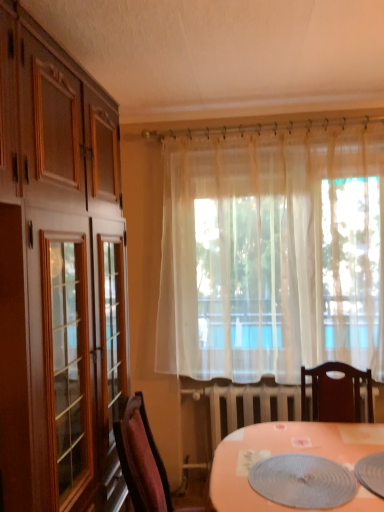
Question: Is sheer white curtain at center at the back of textured gray placemat at lower center?

Choices:
 (A) no
 (B) yes

Answer: (A)

Question: Is textured gray placemat at lower center not near sheer white curtain at center?

Choices:
 (A) no
 (B) yes

Answer: (B)

Question: Does textured gray placemat at lower center appear on the left side of sheer white curtain at center?

Choices:
 (A) no
 (B) yes

Answer: (B)

Question: Considering the relative sizes of textured gray placemat at lower center and sheer white curtain at center in the image provided, is textured gray placemat at lower center shorter than sheer white curtain at center?

Choices:
 (A) no
 (B) yes

Answer: (B)

Question: Is textured gray placemat at lower center to the right of sheer white curtain at center from the viewer's perspective?

Choices:
 (A) yes
 (B) no

Answer: (B)

Question: Does textured gray placemat at lower center have a greater height compared to sheer white curtain at center?

Choices:
 (A) no
 (B) yes

Answer: (A)

Question: From a real-world perspective, is velvet burgundy chair at lower left positioned under sheer white curtain at center based on gravity?

Choices:
 (A) yes
 (B) no

Answer: (A)

Question: Considering the relative positions of velvet burgundy chair at lower left and sheer white curtain at center in the image provided, is velvet burgundy chair at lower left to the right of sheer white curtain at center from the viewer's perspective?

Choices:
 (A) yes
 (B) no

Answer: (B)

Question: Considering the relative positions of velvet burgundy chair at lower left and sheer white curtain at center in the image provided, is velvet burgundy chair at lower left to the left of sheer white curtain at center from the viewer's perspective?

Choices:
 (A) no
 (B) yes

Answer: (B)

Question: Is velvet burgundy chair at lower left oriented away from sheer white curtain at center?

Choices:
 (A) yes
 (B) no

Answer: (B)

Question: Is velvet burgundy chair at lower left oriented towards sheer white curtain at center?

Choices:
 (A) no
 (B) yes

Answer: (A)

Question: Is the depth of velvet burgundy chair at lower left greater than that of sheer white curtain at center?

Choices:
 (A) no
 (B) yes

Answer: (A)

Question: From a real-world perspective, is sheer white curtain at center located higher than velvet burgundy chair at lower left?

Choices:
 (A) no
 (B) yes

Answer: (B)